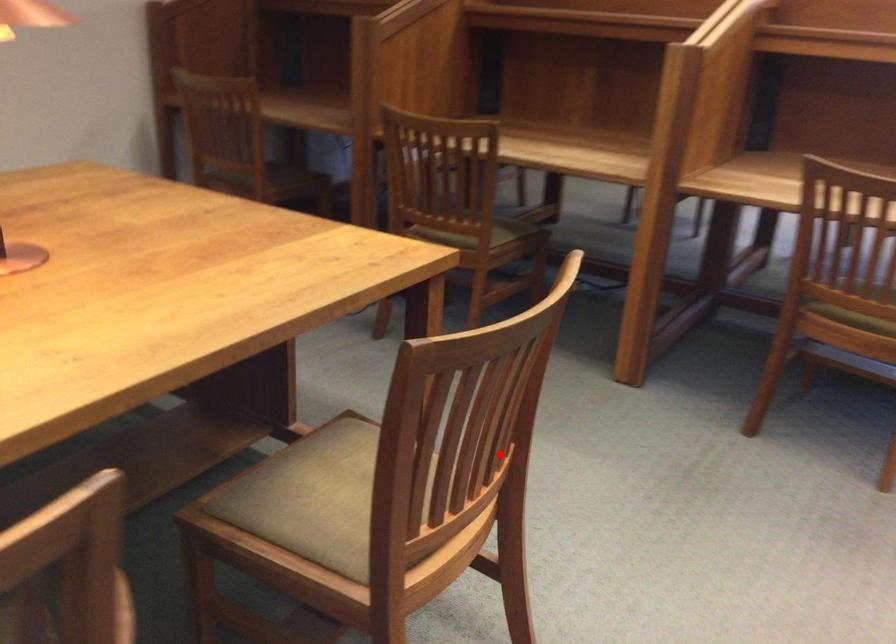
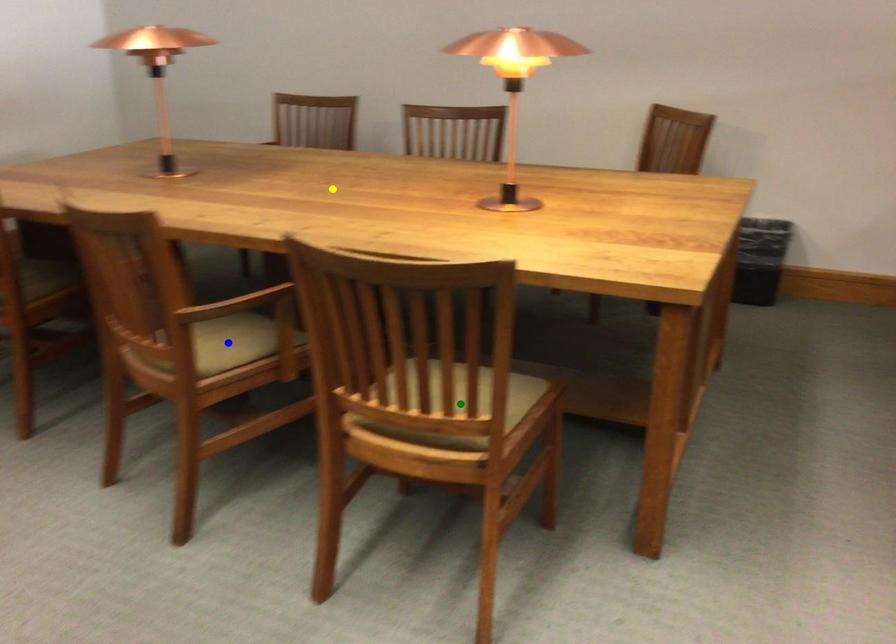
Question: I am providing you with two images of the same scene from different viewpoints. A red point is marked on the first image. You are given multiple points on the second image. Which mark in image 2 goes with the point in image 1?

Choices:
 (A) blue point
 (B) yellow point
 (C) green point

Answer: (C)